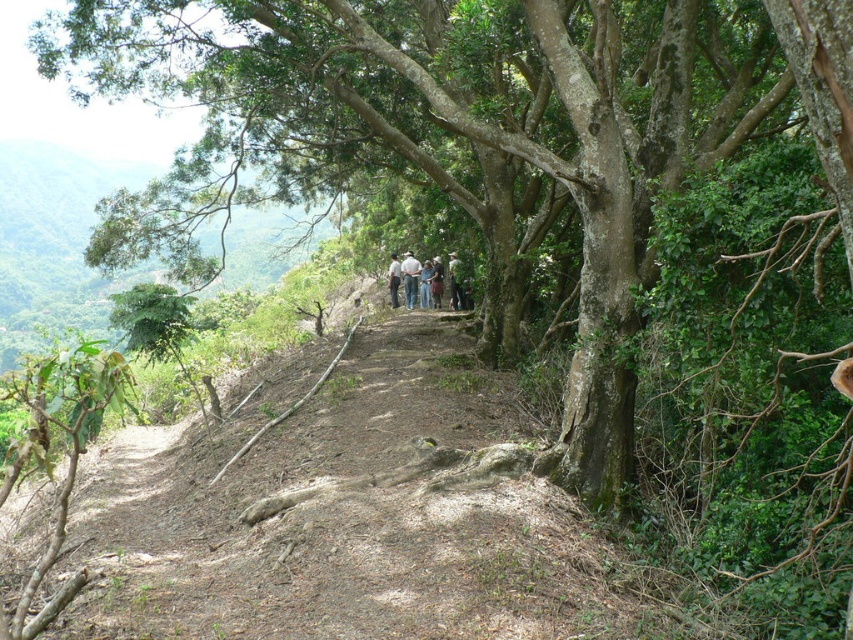
Question: Which point is farther to the camera?

Choices:
 (A) (413, 285)
 (B) (393, 273)

Answer: (B)

Question: Is dark gray shirt at center positioned at the back of white fabric shirt at center?

Choices:
 (A) no
 (B) yes

Answer: (B)

Question: Is dark gray shirt at center positioned before light brown leather jacket at center?

Choices:
 (A) yes
 (B) no

Answer: (A)

Question: Does white cotton shirt at center appear over light brown leather jacket at center?

Choices:
 (A) no
 (B) yes

Answer: (B)

Question: Which is nearer to the dark gray shirt at center?

Choices:
 (A) white cotton shirt at center
 (B) light brown leather jacket at center

Answer: (A)

Question: Which object is farther from the camera taking this photo?

Choices:
 (A) white fabric shirt at center
 (B) light brown leather jacket at center
 (C) dark gray shirt at center

Answer: (B)